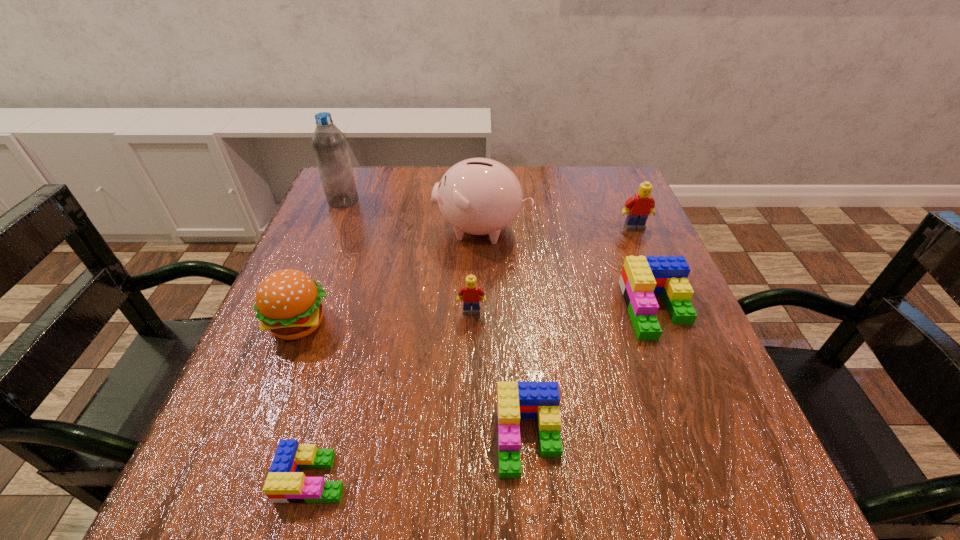
Find the location of `vacant space located 0.110m on the front of the rightmost green Lego`. vacant space located 0.110m on the front of the rightmost green Lego is located at coordinates (691, 394).

Identify the location of free space located on the right of the second biggest green Lego. The height and width of the screenshot is (540, 960). (728, 437).

You are a GUI agent. You are given a task and a screenshot of the screen. Output one action in this format:
    pyautogui.click(x=<x>, y=<y>)
    Task: Click on the vacant area situated 0.300m on the back of the smallest green Lego
    Image resolution: width=960 pixels, height=540 pixels.
    Given the screenshot: What is the action you would take?
    pyautogui.click(x=361, y=303)

This screenshot has height=540, width=960. What are the coordinates of `water bottle present at the far edge` in the screenshot? It's located at [329, 144].

At what (x,y) coordinates should I click in order to perform the action: click on piggy bank positioned at the far edge. Please return your answer as a coordinate pair (x, y). Looking at the image, I should click on (479, 196).

Image resolution: width=960 pixels, height=540 pixels. I want to click on water bottle located at the left edge, so click(329, 144).

Image resolution: width=960 pixels, height=540 pixels. I want to click on hamburger at the left edge, so click(288, 302).

At what (x,y) coordinates should I click in order to perform the action: click on Lego located in the left edge section of the desktop. Please return your answer as a coordinate pair (x, y). Looking at the image, I should click on (285, 484).

You are a GUI agent. You are given a task and a screenshot of the screen. Output one action in this format:
    pyautogui.click(x=<x>, y=<y>)
    Task: Click on the object that is at the far left corner
    The width and height of the screenshot is (960, 540).
    Given the screenshot: What is the action you would take?
    pyautogui.click(x=329, y=144)

Identify the location of object located in the near left corner section of the desktop. (285, 484).